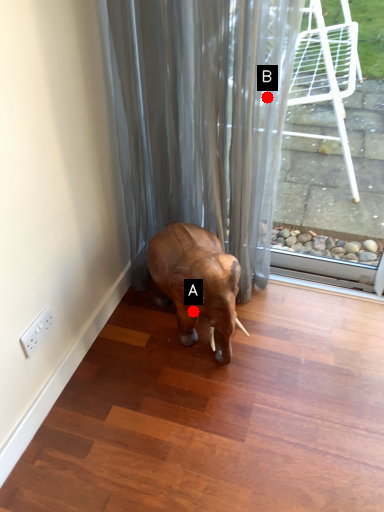
Question: Two points are circled on the image, labeled by A and B beside each circle. Among these points, which one is nearest to the camera?

Choices:
 (A) A is closer
 (B) B is closer

Answer: (B)